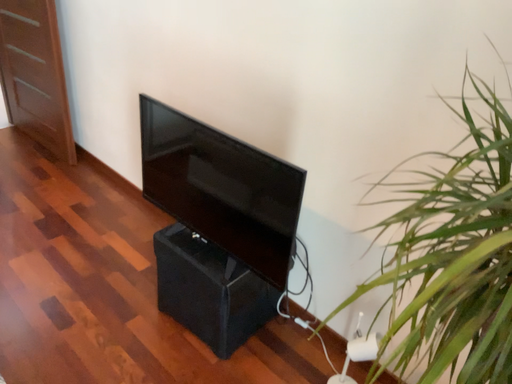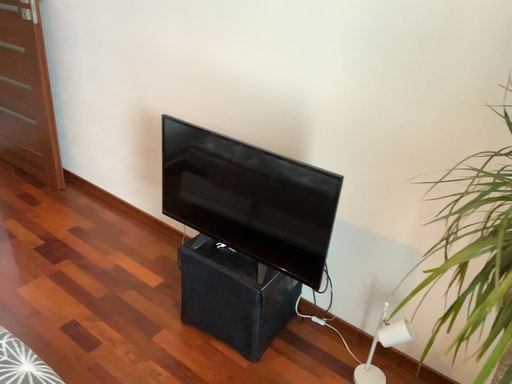
Question: Which way did the camera rotate in the video?

Choices:
 (A) rotated left
 (B) rotated right

Answer: (B)